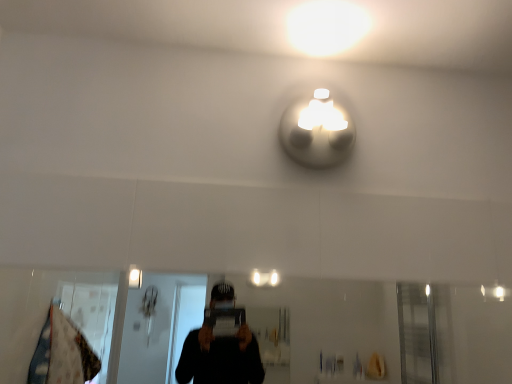
Question: Is white glossy light fixture at upper center inside or outside of transparent glass mirror at lower center?

Choices:
 (A) inside
 (B) outside

Answer: (B)

Question: In the image, is white glossy light fixture at upper center positioned in front of or behind transparent glass mirror at lower center?

Choices:
 (A) behind
 (B) front

Answer: (A)

Question: In terms of height, does white glossy light fixture at upper center look taller or shorter compared to transparent glass mirror at lower center?

Choices:
 (A) tall
 (B) short

Answer: (B)

Question: In terms of width, does transparent glass mirror at lower center look wider or thinner when compared to white glossy light fixture at upper center?

Choices:
 (A) wide
 (B) thin

Answer: (B)

Question: From a real-world perspective, is transparent glass mirror at lower center above or below white glossy light fixture at upper center?

Choices:
 (A) above
 (B) below

Answer: (B)

Question: From the image's perspective, is transparent glass mirror at lower center positioned above or below white glossy light fixture at upper center?

Choices:
 (A) above
 (B) below

Answer: (B)

Question: Which is correct: transparent glass mirror at lower center is inside white glossy light fixture at upper center, or outside of it?

Choices:
 (A) inside
 (B) outside

Answer: (B)